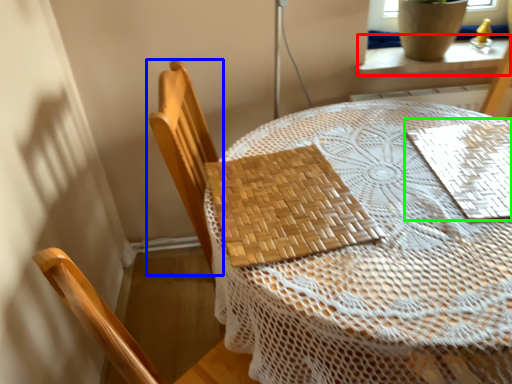
Question: Considering the real-world distances, which object is farthest from window sill (highlighted by a red box)? chair (highlighted by a blue box) or mat (highlighted by a green box)?

Choices:
 (A) chair
 (B) mat

Answer: (A)